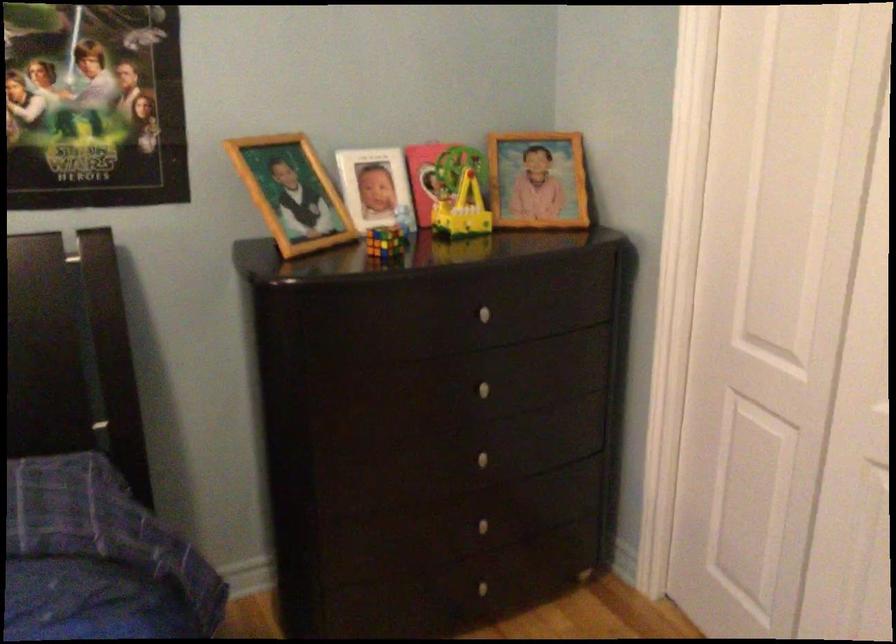
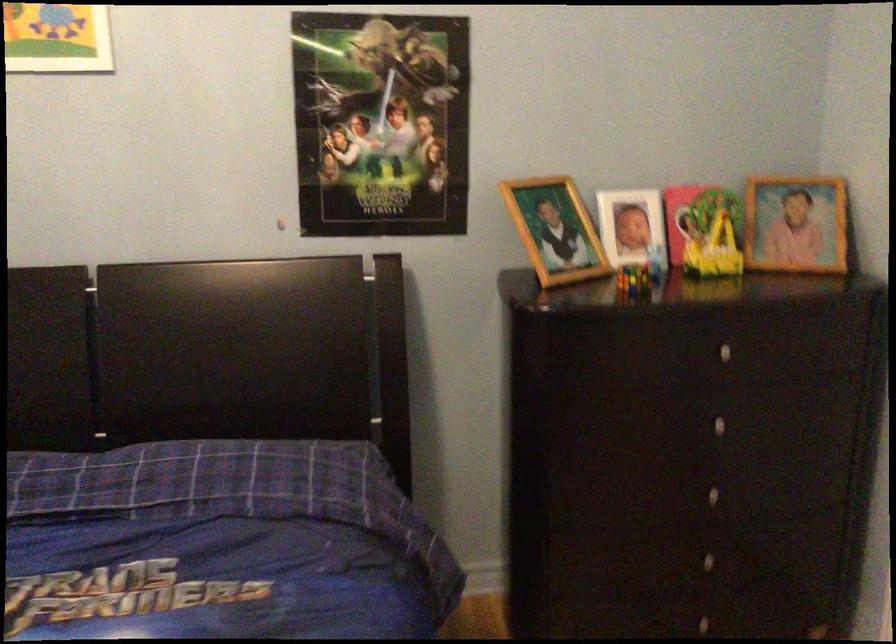
Locate, in the second image, the point that corresponds to point 296,194 in the first image.

(555, 230)